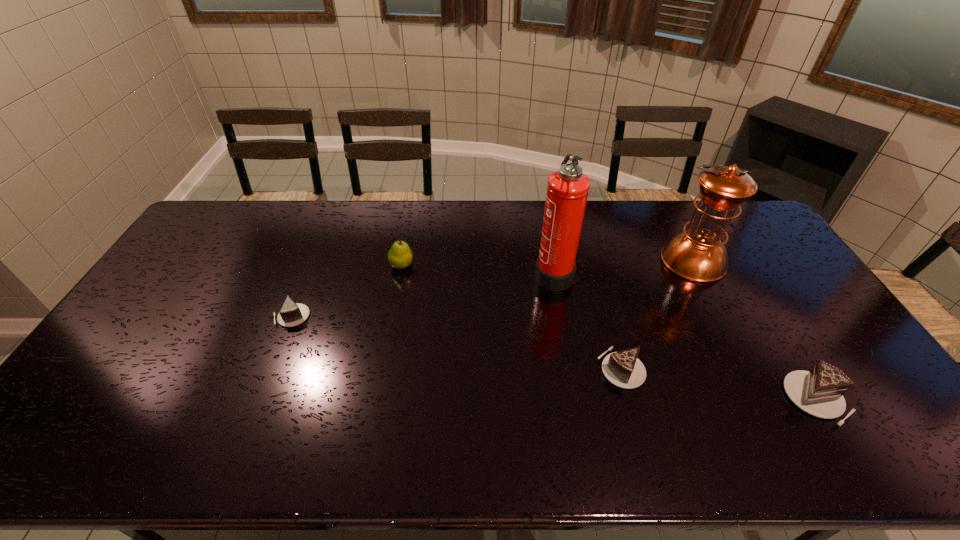
Where is `object that is at the near right corner`? object that is at the near right corner is located at coordinates (819, 392).

The width and height of the screenshot is (960, 540). In the image, there is a desktop. Identify the location of blank space at the far edge. (376, 235).

Find the location of a particular element. The height and width of the screenshot is (540, 960). free space at the near edge of the desktop is located at coordinates (709, 407).

At what (x,y) coordinates should I click in order to perform the action: click on vacant area at the left edge. Please return your answer as a coordinate pair (x, y). Looking at the image, I should click on (177, 292).

Where is `vacant space at the right edge`? The height and width of the screenshot is (540, 960). vacant space at the right edge is located at coordinates (792, 286).

The image size is (960, 540). In the image, there is a desktop. Find the location of `free space at the far left corner`. free space at the far left corner is located at coordinates (201, 230).

Locate an element on the screen. This screenshot has width=960, height=540. free space between the pear and the fire extinguisher is located at coordinates (477, 269).

Locate an element on the screen. Image resolution: width=960 pixels, height=540 pixels. vacant area between the fire extinguisher and the fourth shortest object is located at coordinates (477, 269).

Where is `free point between the oil lamp and the tallest object`? free point between the oil lamp and the tallest object is located at coordinates (623, 267).

Locate an element on the screen. The height and width of the screenshot is (540, 960). vacant space that is in between the fourth shortest object and the fourth tallest object is located at coordinates (609, 332).